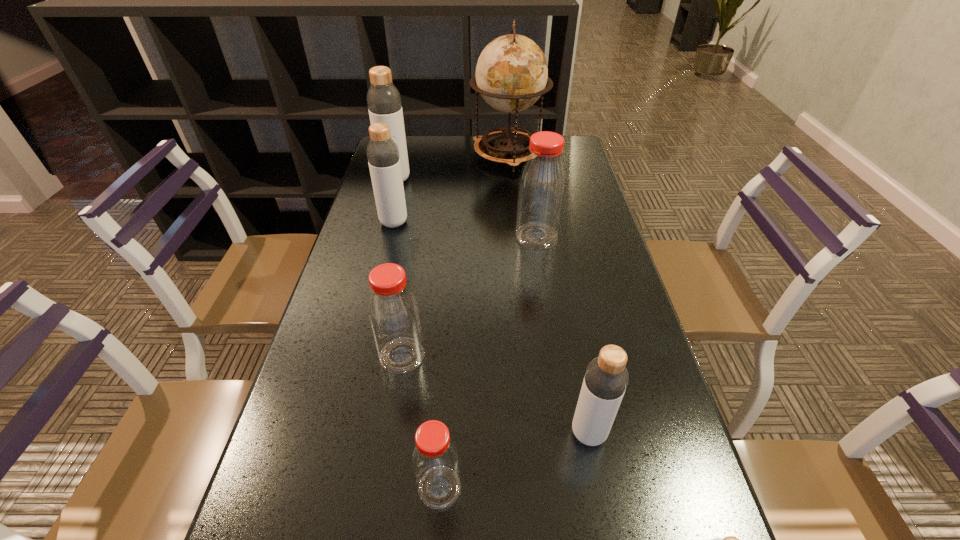
This screenshot has width=960, height=540. In order to click on the tallest object in this screenshot , I will do `click(511, 74)`.

Find the location of `the biggest gray bottle`. the biggest gray bottle is located at coordinates (384, 103).

Locate an element on the screen. the tallest bottle is located at coordinates (384, 103).

This screenshot has width=960, height=540. Find the location of `the second biggest gray bottle`. the second biggest gray bottle is located at coordinates (383, 157).

Locate an element on the screen. The height and width of the screenshot is (540, 960). the farthest red bottle is located at coordinates (542, 184).

Locate an element on the screen. the biggest red bottle is located at coordinates (542, 184).

At what (x,y) coordinates should I click in order to perform the action: click on the fourth nearest object. Please return your answer as a coordinate pair (x, y). Image resolution: width=960 pixels, height=540 pixels. Looking at the image, I should click on (393, 311).

This screenshot has height=540, width=960. I want to click on the second farthest red bottle, so click(x=393, y=311).

I want to click on the third nearest object, so 606,379.

Image resolution: width=960 pixels, height=540 pixels. Find the location of `the second smallest gray bottle`. the second smallest gray bottle is located at coordinates (606, 379).